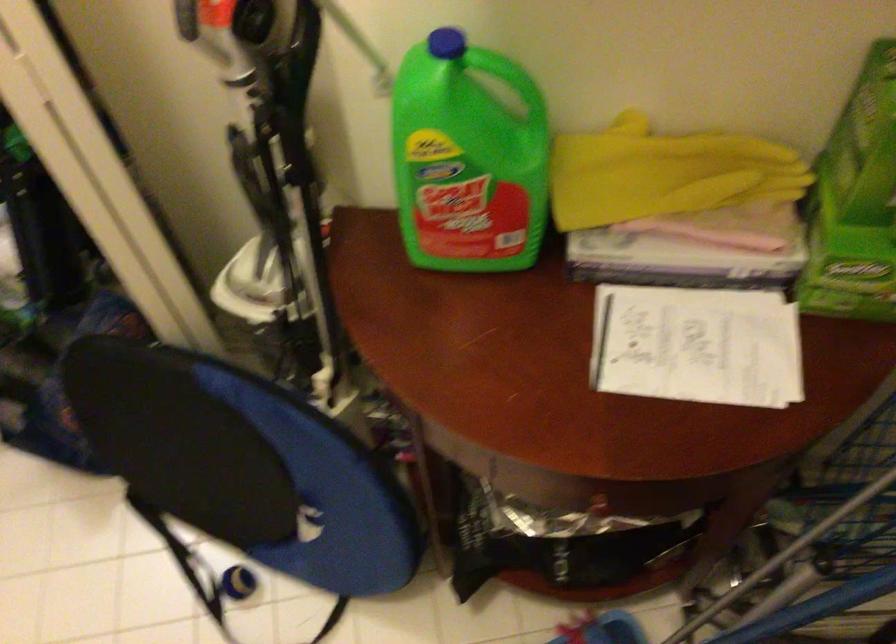
First-person continuous shooting, in which direction is the camera rotating?

The rotation direction of the camera is left-down.